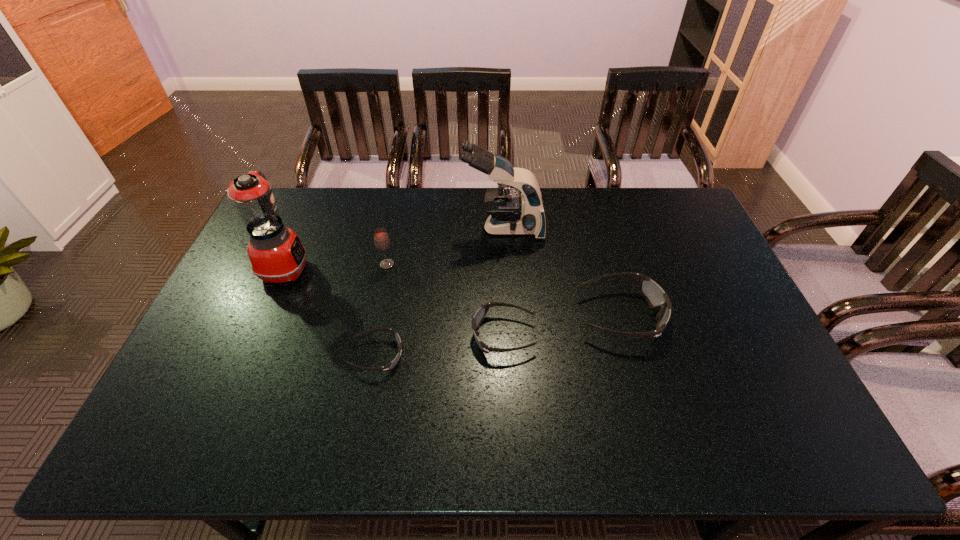
This screenshot has height=540, width=960. What are the coordinates of `the shortest sunglasses` in the screenshot? It's located at (390, 365).

Locate an element on the screen. The height and width of the screenshot is (540, 960). the shortest object is located at coordinates (390, 365).

Find the location of `the second sunglasses from left to right`. the second sunglasses from left to right is located at coordinates (482, 311).

This screenshot has height=540, width=960. I want to click on the second shortest object, so click(482, 311).

The image size is (960, 540). I want to click on the rightmost object, so click(x=655, y=296).

Image resolution: width=960 pixels, height=540 pixels. Find the location of `the third shortest object`. the third shortest object is located at coordinates (655, 296).

Find the location of a particular element. This screenshot has height=540, width=960. the leftmost object is located at coordinates (276, 254).

This screenshot has height=540, width=960. I want to click on microscope, so click(509, 214).

You are a GUI agent. You are given a task and a screenshot of the screen. Output one action in this format:
    pyautogui.click(x=<x>, y=<y>)
    Task: Click on the glass drink container
    The height and width of the screenshot is (540, 960).
    Given the screenshot: What is the action you would take?
    pyautogui.click(x=382, y=242)

At what (x,y) coordinates should I click in order to perform the action: click on free location located on the lenses of the shortest object. Please return your answer as a coordinate pair (x, y). This screenshot has height=540, width=960. Looking at the image, I should click on (442, 355).